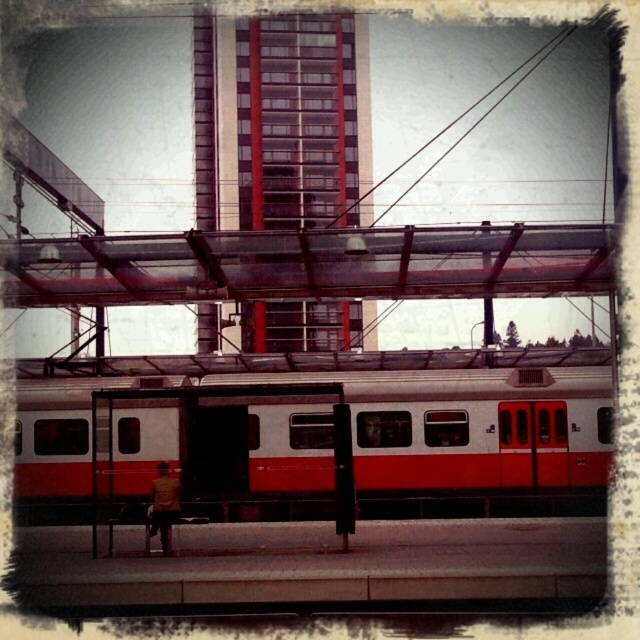
You are standing at the point marked by the coordinates point (x=364, y=433) in the train station scene. What object are you directly facing?

The point (x=364, y=433) marks the white glossy train at center, so you are directly facing the white glossy train at center.

You are a maintenance worker needing to inspect both the white glossy train at center and the red glass building at center. Given that your ladder can only extend to 15 meters, can you reach both objects with the ladder?

The distance between the white glossy train at center and the red glass building at center is 18.30 meters, which exceeds the ladder extension limit of 15 meters. Therefore, you cannot reach both objects with the ladder.

You are standing at the entrance of the train station and want to board the white glossy train at center. Based on the scene description, where should you position yourself relative to the transparent overpass structure to ensure you can see the train clearly?

The white glossy train at center is located at point (364, 433), which means it is positioned towards the lower right of the scene. To see the train clearly from the entrance, you should position yourself under the transparent overpass structure, as it spans across the width of the station and offers an unobstructed view of the train at that location.